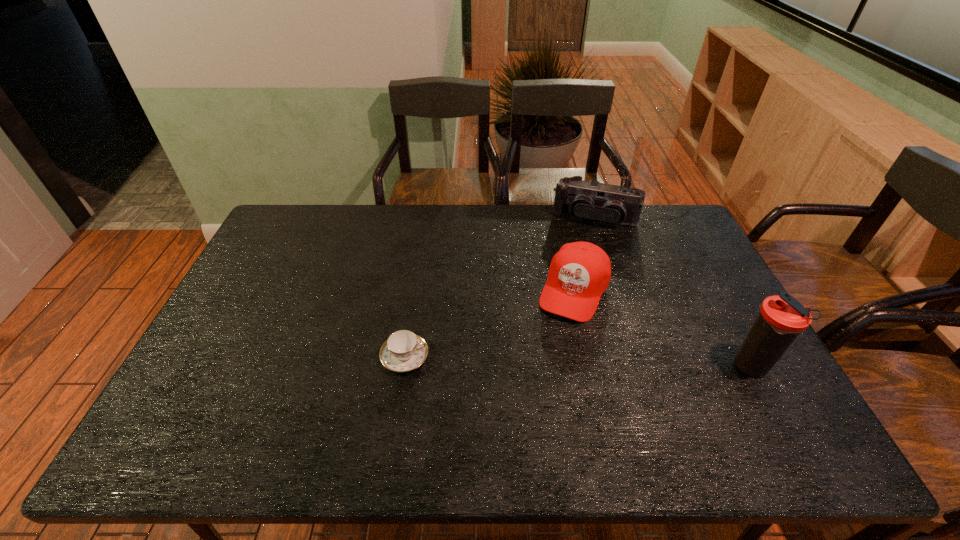
Identify the location of vacant area between the teacup and the thermos bottle. The width and height of the screenshot is (960, 540). (578, 362).

This screenshot has width=960, height=540. Find the location of `vacant space in between the second farthest object and the leftmost object`. vacant space in between the second farthest object and the leftmost object is located at coordinates (490, 323).

The image size is (960, 540). What are the coordinates of `empty space between the leftmost object and the tallest object` in the screenshot? It's located at (578, 362).

Locate an element on the screen. object that stands as the closest to the baseball cap is located at coordinates (x=585, y=200).

Where is `the second closest object to the thermos bottle`? This screenshot has width=960, height=540. the second closest object to the thermos bottle is located at coordinates (585, 200).

The image size is (960, 540). Find the location of `vacant point that satisfies the following two spatial constraints: 1. on the front side of the thermos bottle; 2. on the left side of the baseball cap`. vacant point that satisfies the following two spatial constraints: 1. on the front side of the thermos bottle; 2. on the left side of the baseball cap is located at coordinates (590, 367).